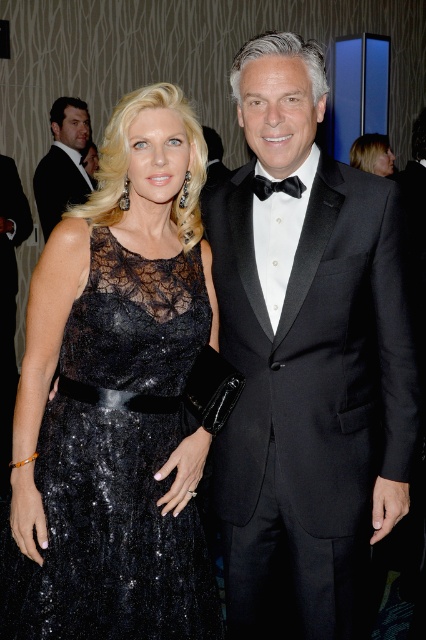
You are standing in front of the formal event scene. There are two points marked in the image. The first point is at coordinate point (160, 396) and the second point is at coordinate point (74, 108). Which point is closer to you?

Point (160, 396) is closer to the viewer than point (74, 108).

You are a photographer setting up for a formal event. You need to ensure that both the black sequined dress at center and the matte black tuxedo at upper left are visible in the frame. Given their heights, which one might require you to adjust your camera angle to capture fully?

The black sequined dress at center is taller than the matte black tuxedo at upper left, so you might need to adjust the camera angle to capture the full height of the black sequined dress at center.

You are a photographer setting up for a formal event. You need to ensure that the satin black dress at upper center and the black satin bow tie at center are both visible in the photo. Given their sizes, which one might require more careful framing to avoid being too small in the shot?

The black satin bow tie at center is smaller than the satin black dress at upper center, so it might require more careful framing to ensure it is visible and not too small in the photo.